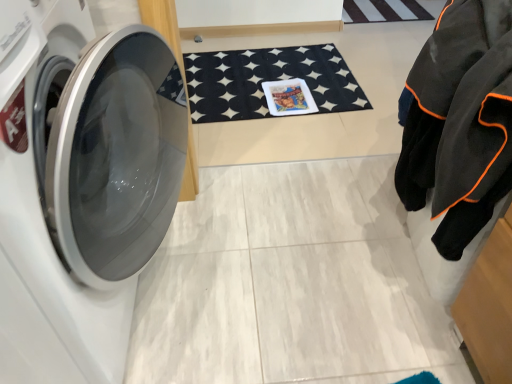
Where is `vacant area that is in front of black felt bath mat at center`? The image size is (512, 384). vacant area that is in front of black felt bath mat at center is located at coordinates (288, 137).